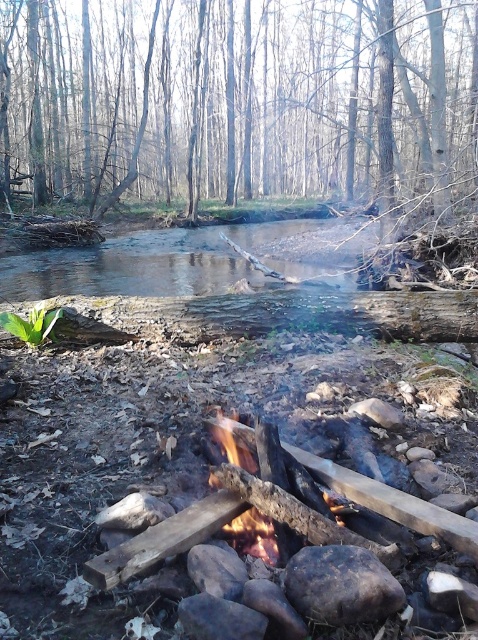
You are planning to put out the charred wood fire at center with the clear water at center. How much water do you think you need to extinguish the fire completely?

The clear water at center is larger in size than charred wood fire at center, so you would need enough water to cover the entire area of the charred wood fire at center. Since the clear water at center is already larger, it should provide sufficient quantity to extinguish the fire completely.

You are standing at the campfire in the forest scene and want to reach the point marked at coordinates (238,99). Which direction should you walk to get there?

The point at (238,99) is located on the brown wood tree at upper center, so you should walk towards the upper center direction from the campfire to reach it.